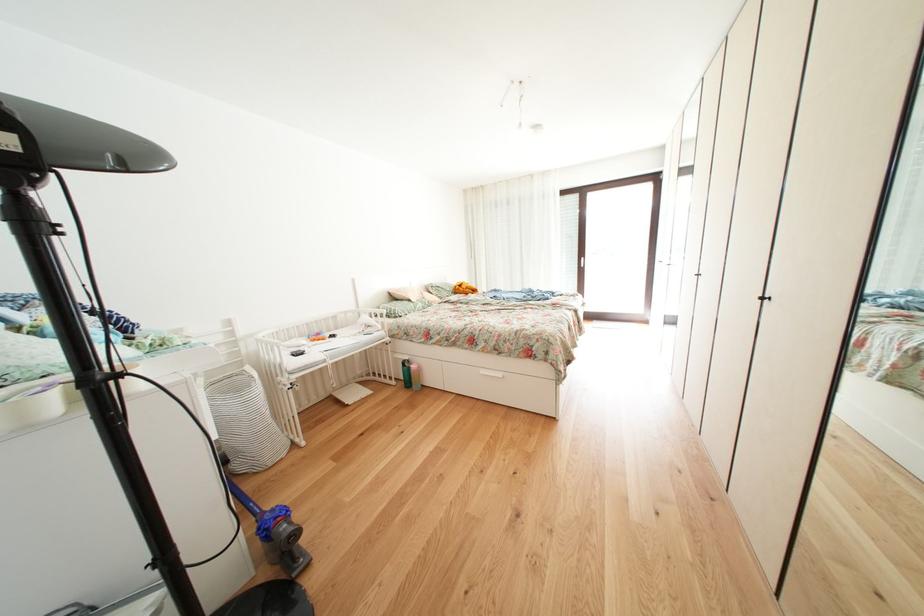
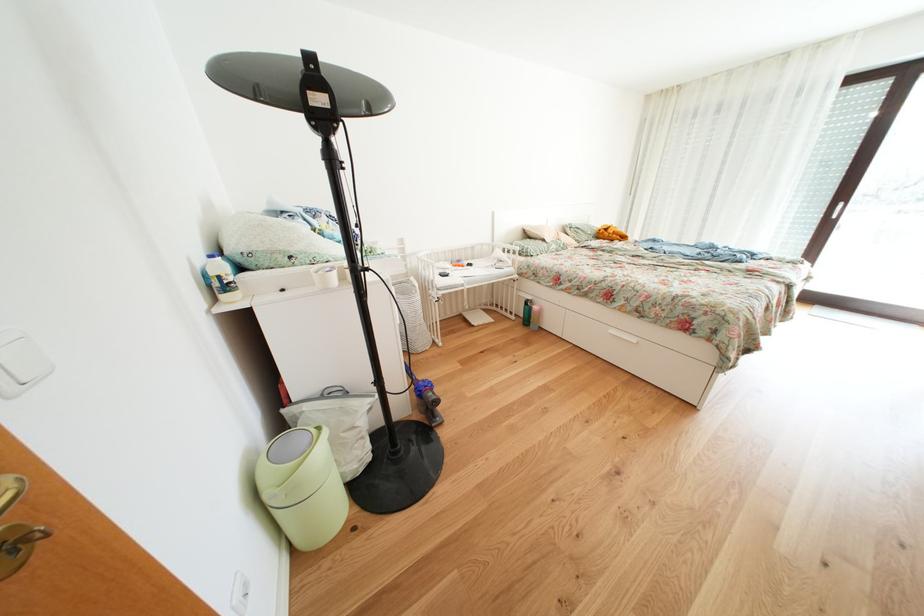
In the second image, find the point that corresponds to the point at 453,543 in the first image.

(550, 459)